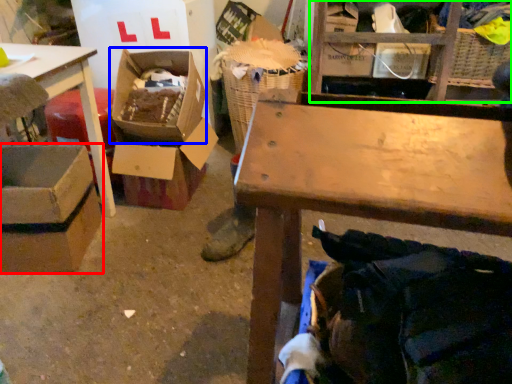
Question: Which object is positioned closest to box (highlighted by a red box)? Select from storage box (highlighted by a blue box) and shelf (highlighted by a green box).

Choices:
 (A) storage box
 (B) shelf

Answer: (A)